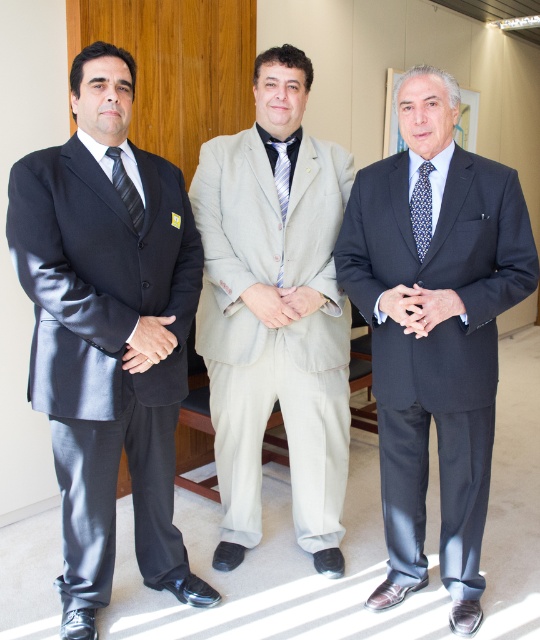
Question: Which object is farther from the camera taking this photo?

Choices:
 (A) blue dotted tie at center
 (B) matte black tie at left
 (C) blue striped tie at center

Answer: (C)

Question: Which of the following is the closest to the observer?

Choices:
 (A) blue striped tie at center
 (B) beige textured suit at center
 (C) blue dotted tie at center

Answer: (C)

Question: Where is matte black suit at left located in relation to matte black suit at center in the image?

Choices:
 (A) above
 (B) below

Answer: (A)

Question: Which point is closer to the camera?

Choices:
 (A) blue striped tie at center
 (B) matte black suit at left
 (C) beige textured suit at center

Answer: (B)

Question: Can you confirm if matte black suit at center is bigger than blue dotted tie at center?

Choices:
 (A) yes
 (B) no

Answer: (A)

Question: Can you confirm if blue dotted tie at center is positioned below matte black tie at left?

Choices:
 (A) no
 (B) yes

Answer: (B)